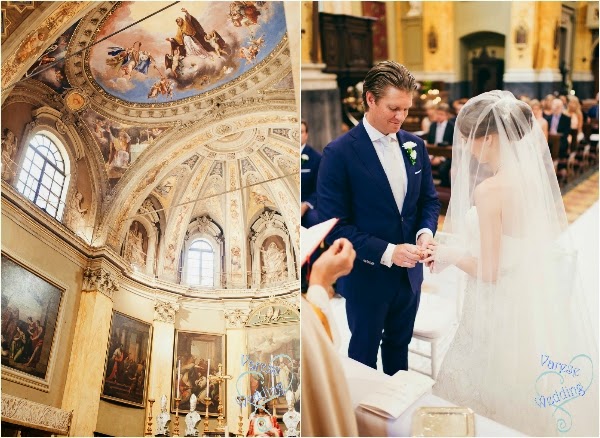
Where is `framed paintings`? framed paintings is located at coordinates (126, 357), (28, 310), (205, 362).